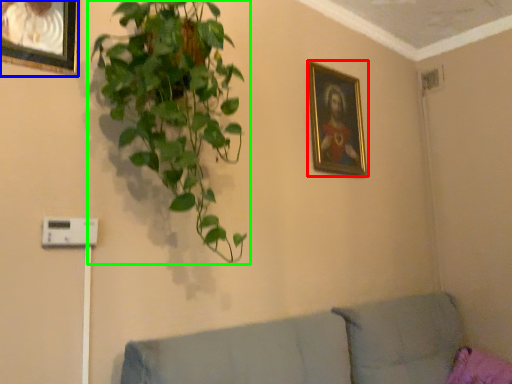
Question: Considering the real-world distances, which object is closest to picture frame (highlighted by a red box)? picture frame (highlighted by a blue box) or houseplant (highlighted by a green box).

Choices:
 (A) picture frame
 (B) houseplant

Answer: (B)